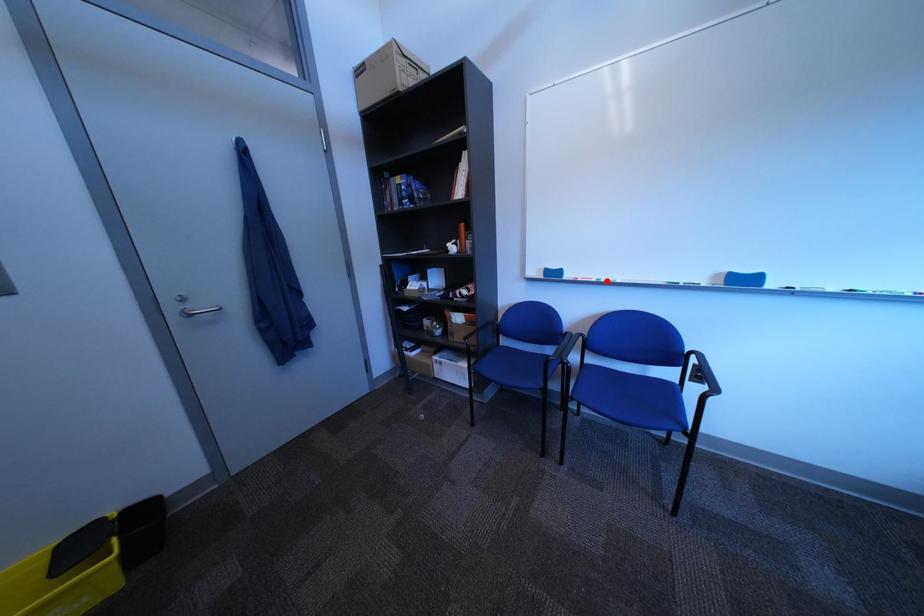
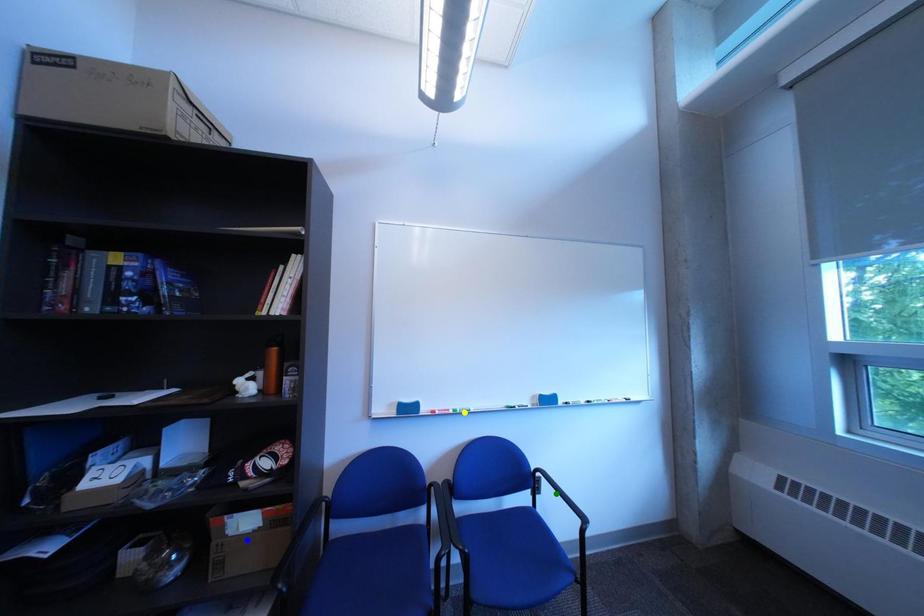
Question: I am providing you with two images of the same scene from different viewpoints. A red point is marked on the first image. You are given multiple points on the second image. Can you choose the point in image 2 that corresponds to the point in image 1?

Choices:
 (A) green point
 (B) yellow point
 (C) blue point

Answer: (B)